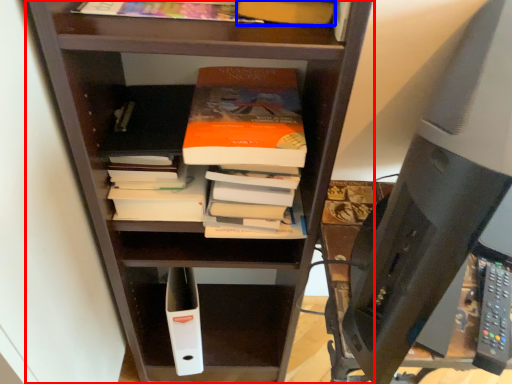
Question: Among these objects, which one is farthest to the camera, shelf (highlighted by a red box) or book (highlighted by a blue box)?

Choices:
 (A) shelf
 (B) book

Answer: (B)